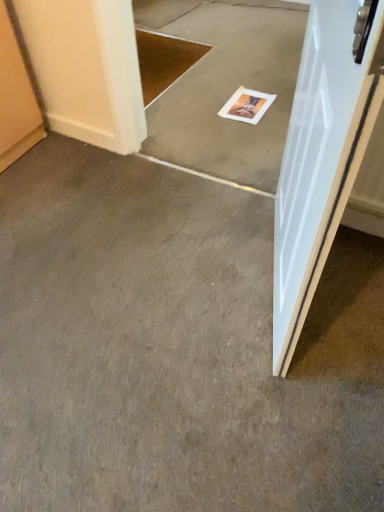
Question: Does white paper magazine at center have a greater width compared to white glossy door at right?

Choices:
 (A) no
 (B) yes

Answer: (B)

Question: From a real-world perspective, is white paper magazine at center positioned under white glossy door at right based on gravity?

Choices:
 (A) no
 (B) yes

Answer: (B)

Question: Is white paper magazine at center facing away from white glossy door at right?

Choices:
 (A) no
 (B) yes

Answer: (A)

Question: Considering the relative positions of white paper magazine at center and white glossy door at right in the image provided, is white paper magazine at center in front of white glossy door at right?

Choices:
 (A) no
 (B) yes

Answer: (A)

Question: Is white paper magazine at center further to camera compared to white glossy door at right?

Choices:
 (A) yes
 (B) no

Answer: (A)

Question: Does white paper magazine at center appear on the right side of white glossy door at right?

Choices:
 (A) no
 (B) yes

Answer: (A)

Question: From a real-world perspective, is smooth gray carpet at center, the 1th concrete in the top-to-bottom sequence, located beneath gray carpet at center, placed as the 2th concrete when sorted from top to bottom?

Choices:
 (A) no
 (B) yes

Answer: (A)

Question: Is smooth gray carpet at center, the 1th concrete in the top-to-bottom sequence, taller than gray carpet at center, placed as the 2th concrete when sorted from top to bottom?

Choices:
 (A) no
 (B) yes

Answer: (B)

Question: Is smooth gray carpet at center, placed as the second concrete when sorted from bottom to top, smaller than gray carpet at center, the first concrete in the bottom-to-top sequence?

Choices:
 (A) yes
 (B) no

Answer: (B)

Question: Is smooth gray carpet at center, placed as the second concrete when sorted from bottom to top, shorter than gray carpet at center, the first concrete in the bottom-to-top sequence?

Choices:
 (A) yes
 (B) no

Answer: (B)

Question: Is the position of smooth gray carpet at center, placed as the second concrete when sorted from bottom to top, more distant than that of gray carpet at center, the first concrete in the bottom-to-top sequence?

Choices:
 (A) yes
 (B) no

Answer: (A)

Question: From the image's perspective, is smooth gray carpet at center, the 1th concrete in the top-to-bottom sequence, below gray carpet at center, the first concrete in the bottom-to-top sequence?

Choices:
 (A) no
 (B) yes

Answer: (A)

Question: Is white glossy door at right further to the viewer compared to white paper magazine at center?

Choices:
 (A) no
 (B) yes

Answer: (A)